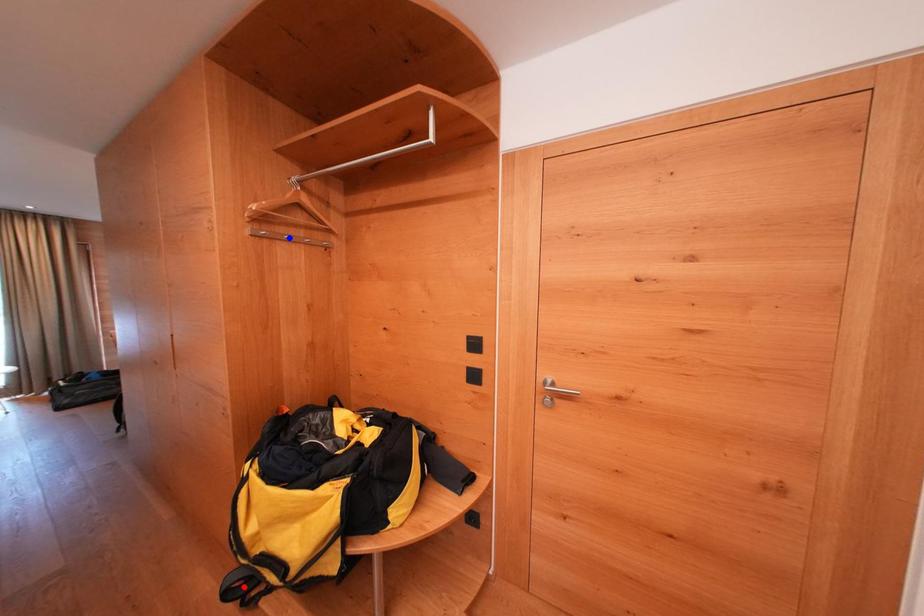
Question: In the image, two points are highlighted. Which point is nearer to the camera? Reply with the corresponding letter.

Choices:
 (A) blue point
 (B) red point

Answer: (B)